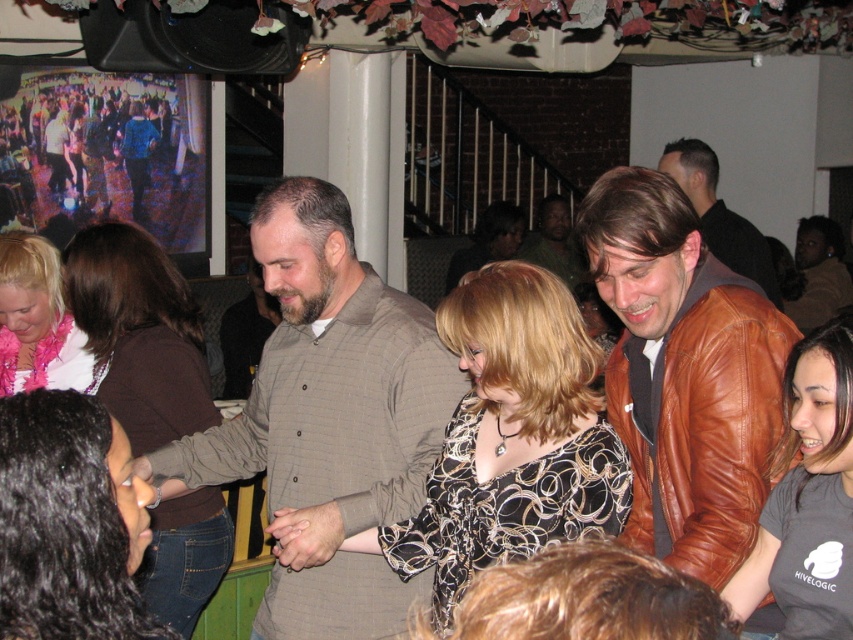
Question: Does dark gray t-shirt at lower right have a lesser width compared to brown leather jacket at center?

Choices:
 (A) yes
 (B) no

Answer: (A)

Question: Among these points, which one is nearest to the camera?

Choices:
 (A) (730, 232)
 (B) (517, 456)

Answer: (B)

Question: Is brown fabric shirt at left below brown leather jacket at upper right?

Choices:
 (A) yes
 (B) no

Answer: (A)

Question: Is brown fabric shirt at left wider than dark gray t-shirt at lower right?

Choices:
 (A) yes
 (B) no

Answer: (A)

Question: Which point is farther from the camera taking this photo?

Choices:
 (A) (107, 333)
 (B) (77, 420)

Answer: (A)

Question: Which object is the closest to the brown fabric shirt at left?

Choices:
 (A) black printed blouse at center
 (B) matte pink scarf at lower left
 (C) black hair at lower left

Answer: (B)